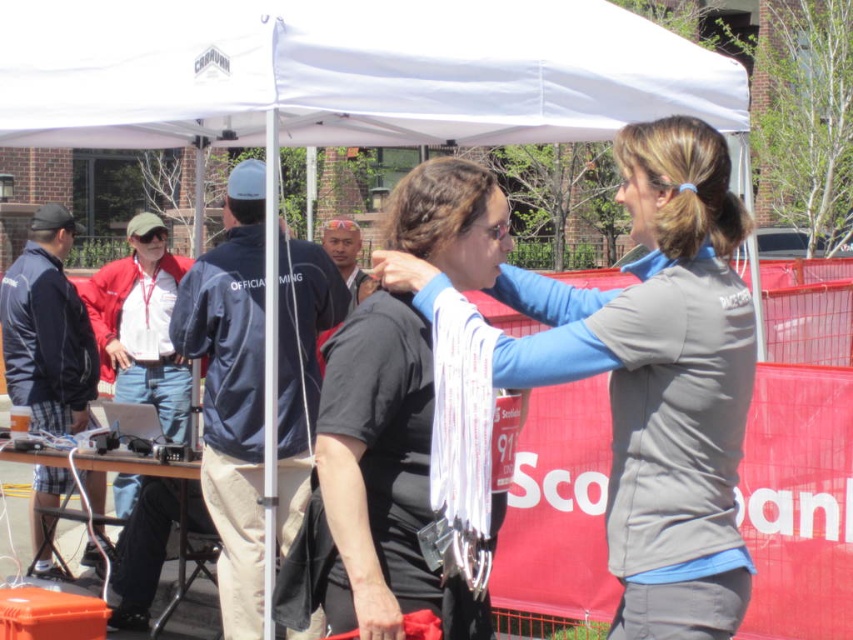
Question: Which object is the closest to the gray fabric jacket at center?

Choices:
 (A) white fabric canopy at upper center
 (B) navy blue fleece jacket at left
 (C) dark blue jacket at left

Answer: (A)

Question: Which point appears farthest from the camera in this image?

Choices:
 (A) pyautogui.click(x=312, y=276)
 (B) pyautogui.click(x=357, y=22)

Answer: (A)

Question: Is the position of gray fabric jacket at center more distant than that of navy blue fleece jacket at left?

Choices:
 (A) yes
 (B) no

Answer: (B)

Question: Among these objects, which one is farthest from the camera?

Choices:
 (A) white fabric canopy at upper center
 (B) gray fabric jacket at center
 (C) dark blue jacket at left

Answer: (C)

Question: Where is gray fabric jacket at center located in relation to navy blue fleece jacket at left in the image?

Choices:
 (A) above
 (B) below

Answer: (A)

Question: Does white fabric canopy at upper center come in front of dark blue jacket at left?

Choices:
 (A) yes
 (B) no

Answer: (A)